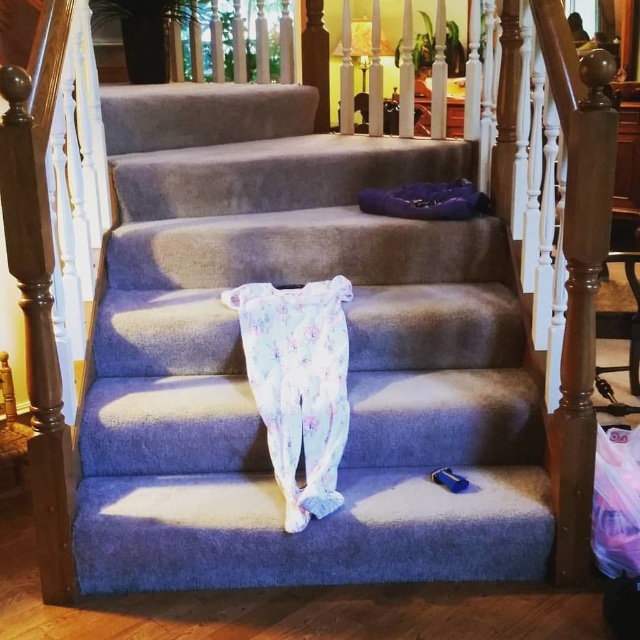
Is point (518, 576) more distant than point (284, 476)?

No, it is not.

At what (x,y) coordinates should I click in order to perform the action: click on blue carpet at center. Please return your answer as a coordinate pair (x, y). Looking at the image, I should click on click(348, 358).

At what (x,y) coordinates should I click in order to perform the action: click on blue carpet at center. Please return your answer as a coordinate pair (x, y). Looking at the image, I should click on (348, 358).

Does point (337, 317) lie behind point (372, 200)?

No, it is not.

Is point (307, 340) positioned behind point (464, 189)?

No, (307, 340) is closer to viewer.

The image size is (640, 640). Find the location of `fluffy cotton leggings at center`. fluffy cotton leggings at center is located at coordinates (298, 385).

Is point (362, 292) farther from viewer compared to point (426, 204)?

No, (362, 292) is in front of (426, 204).

Is point (410, 250) less distant than point (413, 195)?

Yes.

Locate an element on the screen. The image size is (640, 640). blue carpet at center is located at coordinates (348, 358).